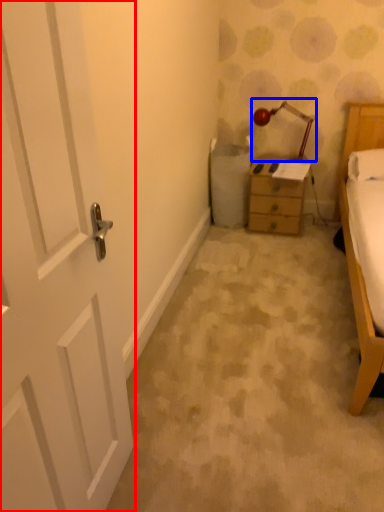
Question: Which of the following is the farthest to the observer, door (highlighted by a red box) or lamp (highlighted by a blue box)?

Choices:
 (A) door
 (B) lamp

Answer: (B)